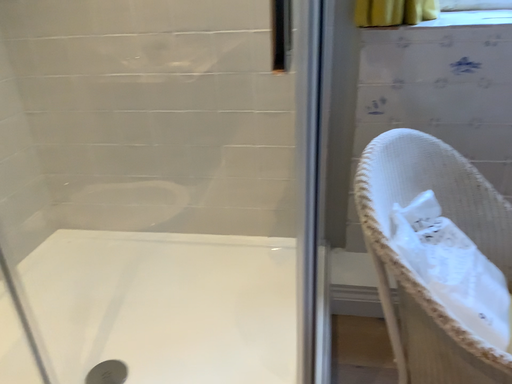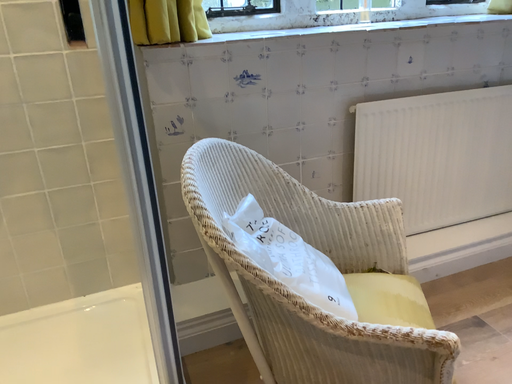
Question: Which way did the camera rotate in the video?

Choices:
 (A) rotated right
 (B) rotated left

Answer: (A)